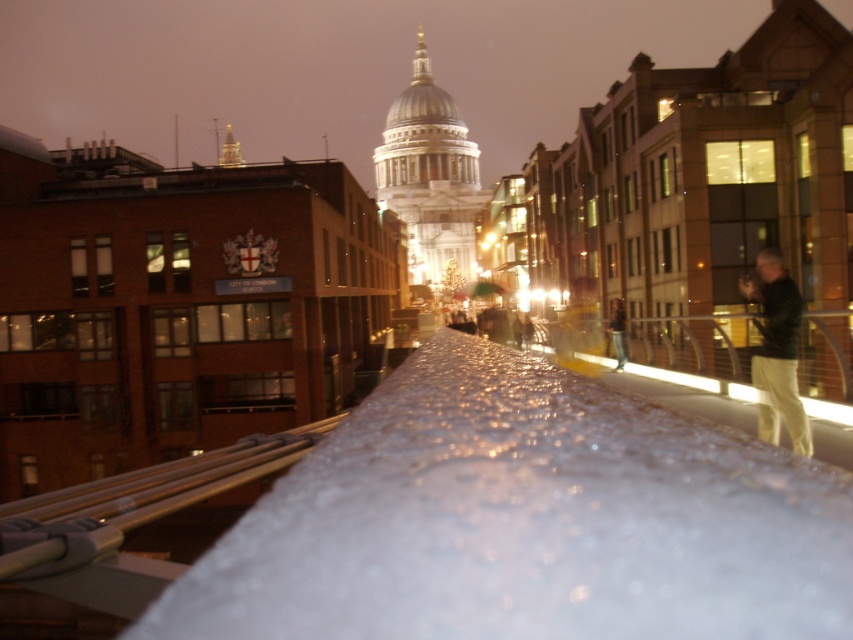
Which is behind, point (387, 566) or point (610, 317)?

Point (610, 317)

Is point (717, 440) positioned in front of point (614, 349)?

Yes, it is.

Where is `transparent frosted snow at center`? The image size is (853, 640). transparent frosted snow at center is located at coordinates (525, 520).

Can you confirm if dark green jacket at right is positioned to the right of light brown leather jacket at right?

Correct, you'll find dark green jacket at right to the right of light brown leather jacket at right.

Does dark green jacket at right lie in front of light brown leather jacket at right?

Yes, dark green jacket at right is closer to the viewer.

What do you see at coordinates (776, 353) in the screenshot? Image resolution: width=853 pixels, height=640 pixels. I see `dark green jacket at right` at bounding box center [776, 353].

You are a GUI agent. You are given a task and a screenshot of the screen. Output one action in this format:
    pyautogui.click(x=<x>, y=<y>)
    Task: Click on the dark green jacket at right
    The height and width of the screenshot is (640, 853).
    Given the screenshot: What is the action you would take?
    pyautogui.click(x=776, y=353)

Which is below, transparent frosted snow at center or dark green jacket at right?

transparent frosted snow at center is lower down.

Can you confirm if transparent frosted snow at center is positioned below dark green jacket at right?

Yes.

Between point (714, 618) and point (785, 417), which one is positioned in front?

Point (714, 618) is more forward.

Locate an element on the screen. This screenshot has width=853, height=640. transparent frosted snow at center is located at coordinates (525, 520).